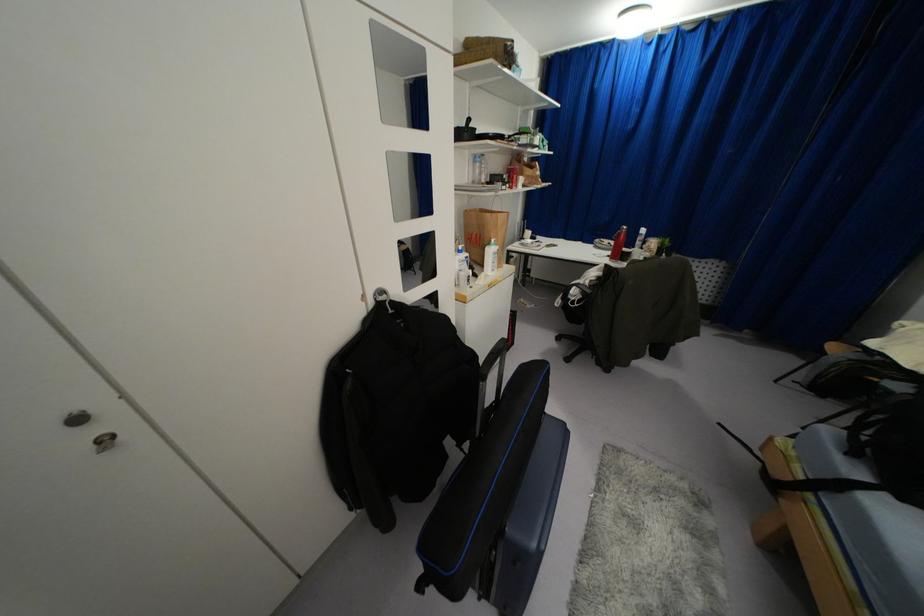
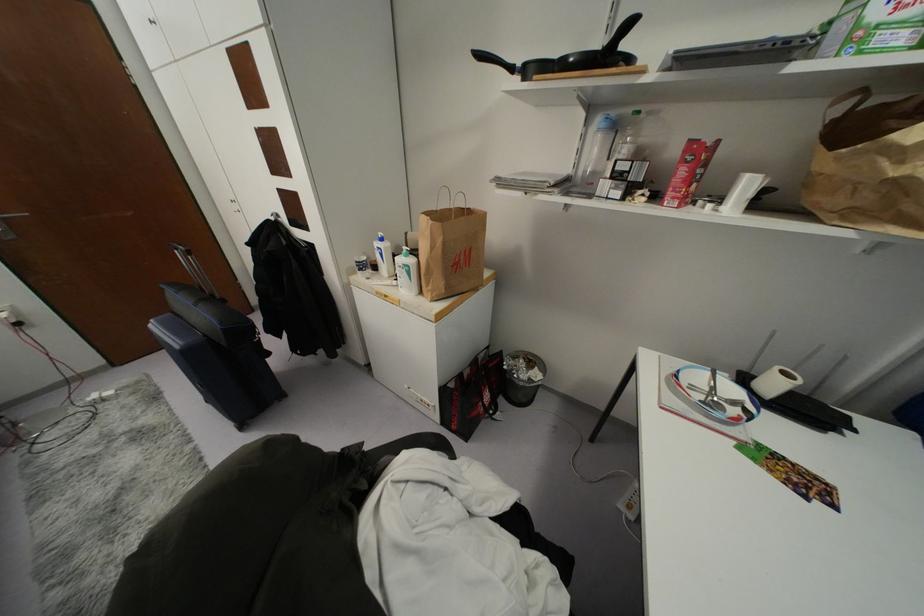
The point at (475, 161) is marked in the first image. Where is the corresponding point in the second image?

(599, 130)